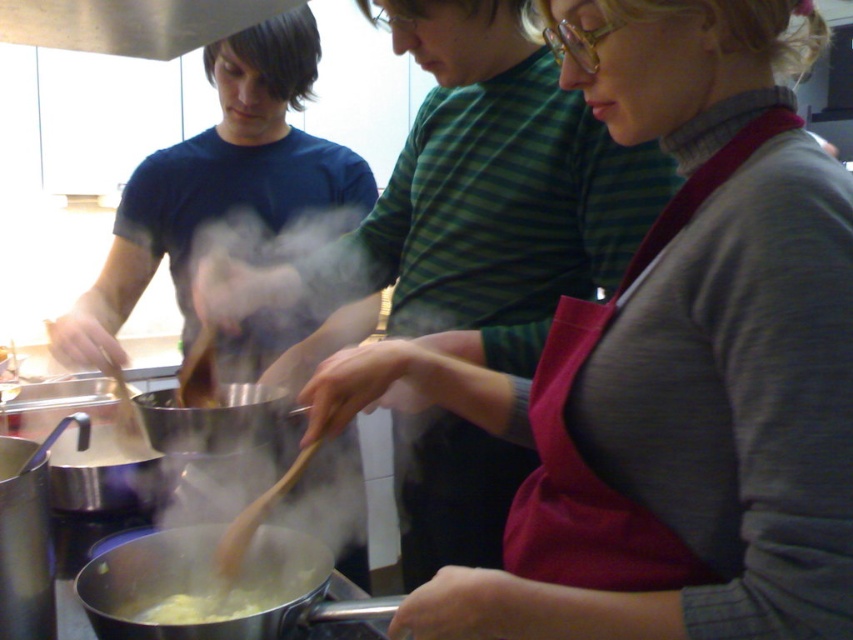
Consider the image. Does stainless steel pot at lower center have a smaller size compared to shiny silver pot at center?

No, stainless steel pot at lower center is not smaller than shiny silver pot at center.

Can you confirm if stainless steel pot at lower center is wider than shiny silver pot at center?

Yes, stainless steel pot at lower center is wider than shiny silver pot at center.

Between point (102, 589) and point (210, 448), which one is positioned in front?

Point (102, 589)

Where is `stainless steel pot at lower center`? The height and width of the screenshot is (640, 853). stainless steel pot at lower center is located at coordinates (212, 586).

Consider the image. Which of these two, stainless steel pot at lower center or yellow creamy pasta at lower center, stands taller?

stainless steel pot at lower center

Can you confirm if stainless steel pot at lower center is wider than yellow creamy pasta at lower center?

Yes.

Is point (177, 528) positioned after point (260, 609)?

That is True.

This screenshot has height=640, width=853. I want to click on stainless steel pot at lower center, so click(212, 586).

Is shiny silver pot at center thinner than yellow creamy pasta at lower center?

In fact, shiny silver pot at center might be wider than yellow creamy pasta at lower center.

Between point (140, 404) and point (315, 573), which one is positioned in front?

Point (315, 573)

Between point (142, 424) and point (171, 621), which one is positioned in front?

Point (171, 621) is more forward.

At what (x,y) coordinates should I click in order to perform the action: click on shiny silver pot at center. Please return your answer as a coordinate pair (x, y). Looking at the image, I should click on (213, 419).